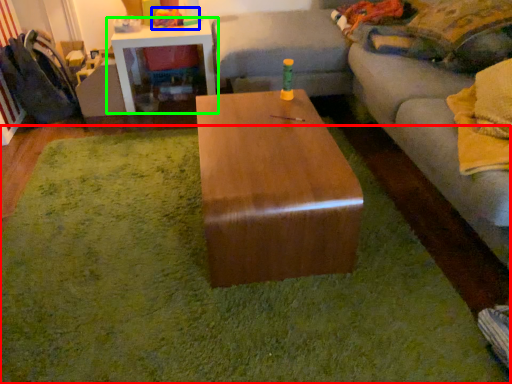
Question: Estimate the real-world distances between objects in this image. Which object is closer to mat (highlighted by a red box), toy (highlighted by a blue box) or table (highlighted by a green box)?

Choices:
 (A) toy
 (B) table

Answer: (B)